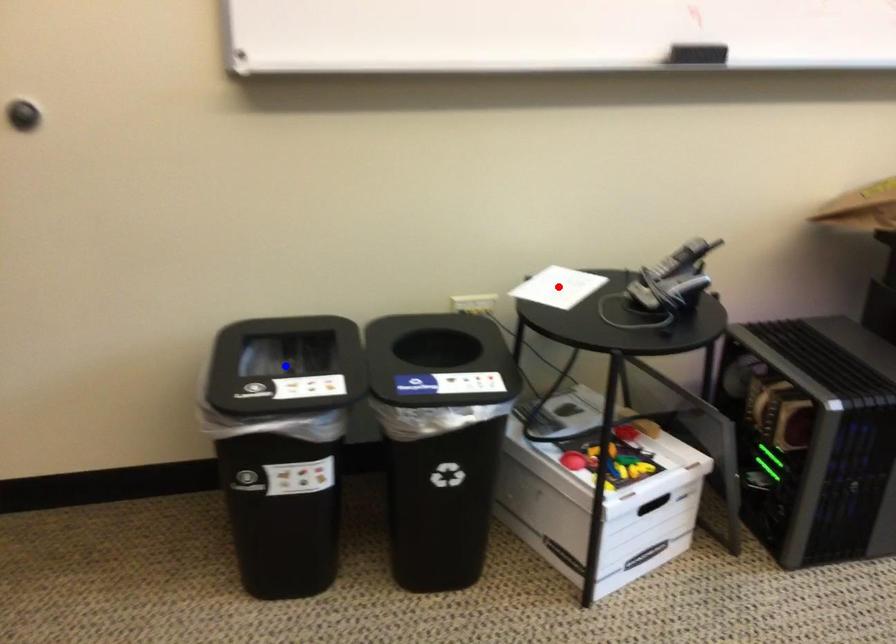
Question: In the image, two points are highlighted. Which point is nearer to the camera? Reply with the corresponding letter.

Choices:
 (A) blue point
 (B) red point

Answer: (A)